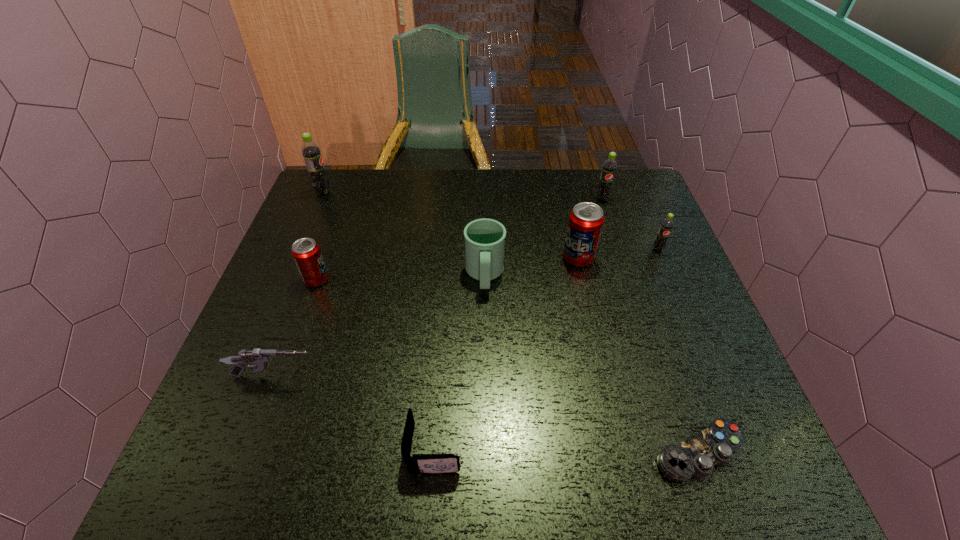
Where is `free space between the third shortest object and the second shortest object`? free space between the third shortest object and the second shortest object is located at coordinates (354, 412).

You are a GUI agent. You are given a task and a screenshot of the screen. Output one action in this format:
    pyautogui.click(x=<x>, y=<y>)
    Task: Click on the free spot between the gun and the smaller red soda can
    
    Given the screenshot: What is the action you would take?
    pyautogui.click(x=296, y=328)

At what (x,y) coordinates should I click in order to perform the action: click on free space between the farther red soda can and the leftmost green soda. Please return your answer as a coordinate pair (x, y). The width and height of the screenshot is (960, 540). Looking at the image, I should click on (450, 225).

This screenshot has height=540, width=960. What are the coordinates of `object that stands as the second closest to the biggest green soda` in the screenshot? It's located at (484, 238).

I want to click on the fifth closest object to the second soda can from left to right, so click(586, 219).

The width and height of the screenshot is (960, 540). What are the coordinates of `soda can that stands as the second closest to the left red soda can` in the screenshot? It's located at (586, 219).

This screenshot has width=960, height=540. Identify the location of soda can that is the closest to the sixth object from left to right. click(667, 224).

Identify which green soda is located as the second nearest to the farther red soda can. Please provide its 2D coordinates. Your answer should be formatted as a tuple, i.e. [(x, y)], where the tuple contains the x and y coordinates of a point satisfying the conditions above.

[(609, 167)]

Locate which green soda ranks third in proximity to the green mug. Please provide its 2D coordinates. Your answer should be formatted as a tuple, i.e. [(x, y)], where the tuple contains the x and y coordinates of a point satisfying the conditions above.

[(311, 152)]

Locate an element on the screen. Image resolution: width=960 pixels, height=540 pixels. vacant area that satisfies the following two spatial constraints: 1. on the back side of the shortest object; 2. on the front label of the biggest green soda is located at coordinates (609, 192).